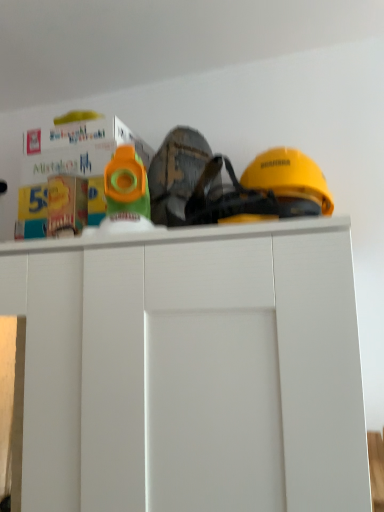
Locate an element on the screen. The width and height of the screenshot is (384, 512). yellow matte helmet at upper right is located at coordinates (289, 178).

What do you see at coordinates (289, 178) in the screenshot?
I see `yellow matte helmet at upper right` at bounding box center [289, 178].

Locate an element on the screen. This screenshot has height=512, width=384. yellow matte helmet at upper right is located at coordinates (289, 178).